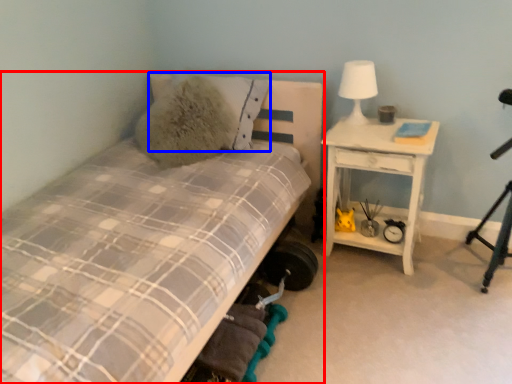
Question: Which point is further to the camera, bed (highlighted by a red box) or pillow (highlighted by a blue box)?

Choices:
 (A) bed
 (B) pillow

Answer: (B)